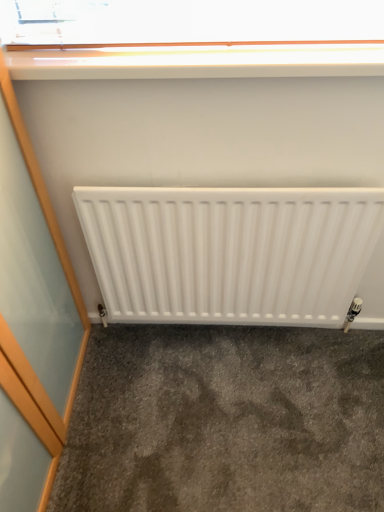
Question: From the image's perspective, is white matte radiator at center on top of white glossy window sill at upper center?

Choices:
 (A) yes
 (B) no

Answer: (B)

Question: Does white matte radiator at center come in front of white glossy window sill at upper center?

Choices:
 (A) no
 (B) yes

Answer: (A)

Question: Considering the relative positions of white matte radiator at center and white glossy window sill at upper center in the image provided, is white matte radiator at center behind white glossy window sill at upper center?

Choices:
 (A) yes
 (B) no

Answer: (A)

Question: Can you confirm if white matte radiator at center is thinner than white glossy window sill at upper center?

Choices:
 (A) yes
 (B) no

Answer: (A)

Question: Considering the relative positions of white matte radiator at center and white glossy window sill at upper center in the image provided, is white matte radiator at center to the left of white glossy window sill at upper center from the viewer's perspective?

Choices:
 (A) no
 (B) yes

Answer: (A)

Question: Is white matte radiator at center turned away from white glossy window sill at upper center?

Choices:
 (A) yes
 (B) no

Answer: (B)

Question: Does gray carpet at lower center have a larger size compared to white glossy window sill at upper center?

Choices:
 (A) yes
 (B) no

Answer: (A)

Question: Is gray carpet at lower center positioned behind white glossy window sill at upper center?

Choices:
 (A) yes
 (B) no

Answer: (A)

Question: Is gray carpet at lower center to the right of white glossy window sill at upper center from the viewer's perspective?

Choices:
 (A) yes
 (B) no

Answer: (A)

Question: Could you tell me if gray carpet at lower center is turned towards white glossy window sill at upper center?

Choices:
 (A) yes
 (B) no

Answer: (B)

Question: From the image's perspective, is gray carpet at lower center below white glossy window sill at upper center?

Choices:
 (A) yes
 (B) no

Answer: (A)

Question: Is gray carpet at lower center completely or partially outside of white glossy window sill at upper center?

Choices:
 (A) no
 (B) yes

Answer: (B)

Question: Does white glossy window sill at upper center have a lesser height compared to white matte radiator at center?

Choices:
 (A) yes
 (B) no

Answer: (A)